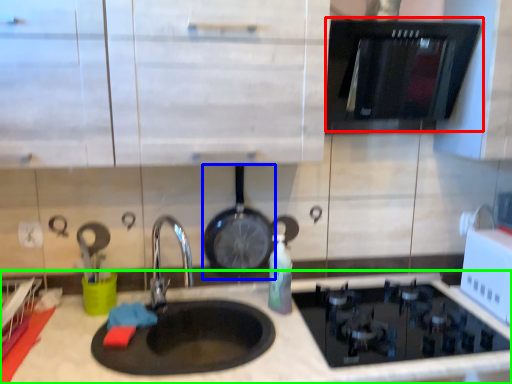
Question: Estimate the real-world distances between objects in this image. Which object is farther from oven (highlighted by a red box), wok (highlighted by a blue box) or countertop (highlighted by a green box)?

Choices:
 (A) wok
 (B) countertop

Answer: (B)